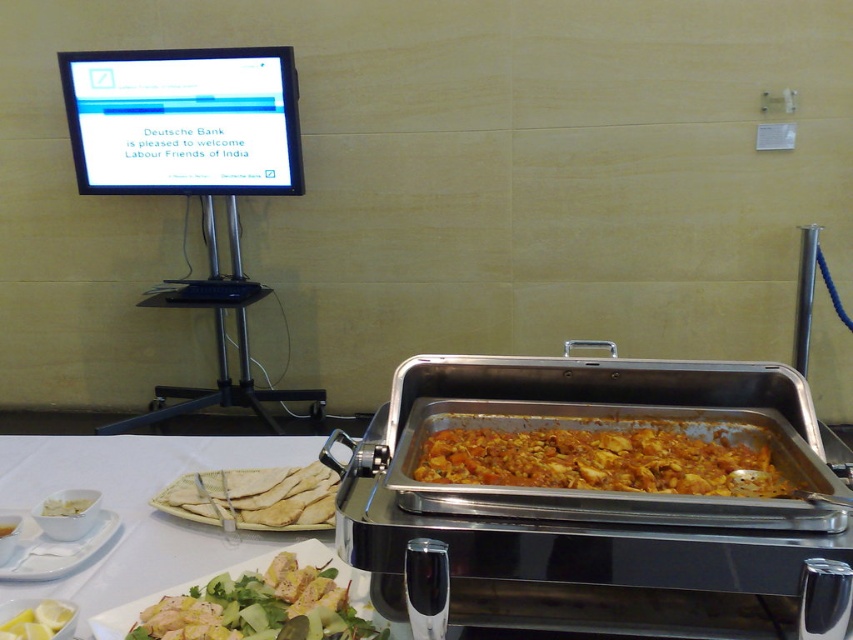
Question: From the image, what is the correct spatial relationship of white matte platter at lower left in relation to yellow matte lemon at lower left?

Choices:
 (A) left
 (B) right

Answer: (A)

Question: Among these objects, which one is nearest to the camera?

Choices:
 (A) white matte bowl at lower left
 (B) yellowish glossy chicken salad at lower center

Answer: (B)

Question: Which point appears farthest from the camera in this image?

Choices:
 (A) (161, 467)
 (B) (0, 634)

Answer: (A)

Question: Is white matte platter at lower left closer to camera compared to yellow matte lemon at lower left?

Choices:
 (A) no
 (B) yes

Answer: (A)

Question: Is orange-brown textured chicken at center below white matte platter at lower left?

Choices:
 (A) yes
 (B) no

Answer: (B)

Question: Which point is closer to the camera?

Choices:
 (A) yellow matte lemon at lower left
 (B) white matte bowl at lower left

Answer: (A)